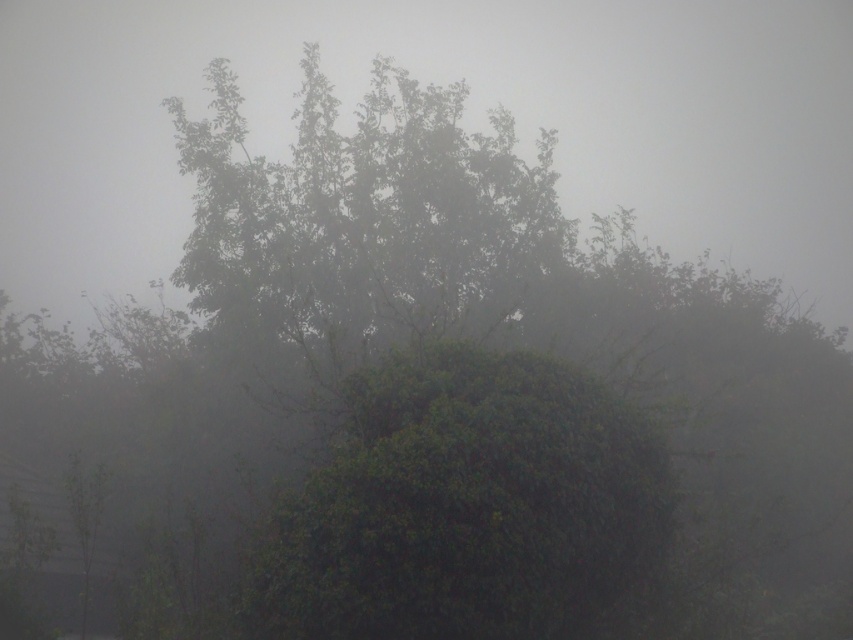
You are an explorer navigating through a foggy forest. You notice the foggy translucent morning fog at upper center and the green leafy bush at center. Which object is closer to you?

The green leafy bush at center is closer to you because the foggy translucent morning fog at upper center is further away.

You are a hiker trying to navigate through the foggy forest. You see the foggy translucent morning fog at upper center and the green leafy bush at center. Which object is bigger in size?

The foggy translucent morning fog at upper center has a larger size compared to the green leafy bush at center.

Consider the image. You are an explorer navigating through a foggy forest. You see the foggy translucent morning fog at upper center and the green leafy bush at center. Which object is wider in this scene?

The foggy translucent morning fog at upper center might be wider than green leafy bush at center.